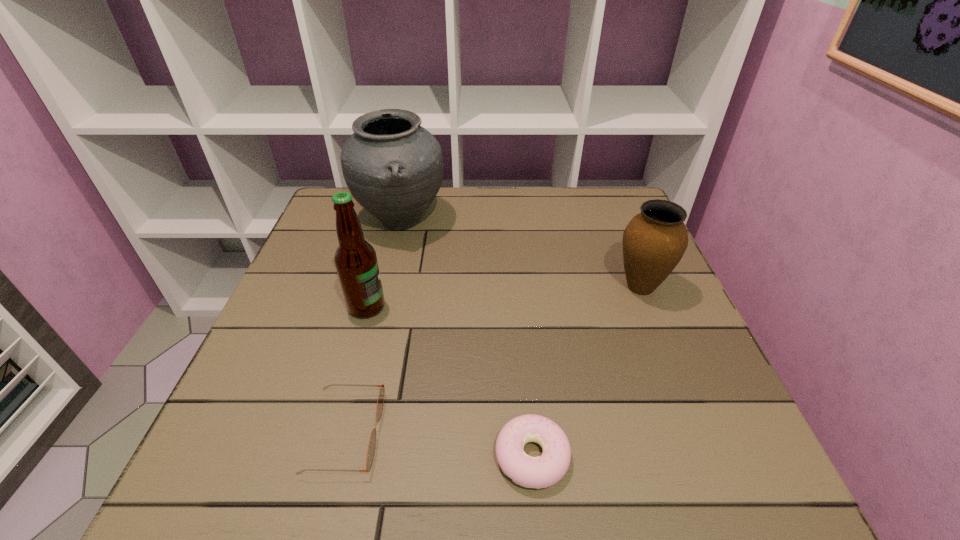
Where is `object that is at the near left corner`? object that is at the near left corner is located at coordinates (372, 442).

The width and height of the screenshot is (960, 540). What are the coordinates of `blank space at the far edge of the desktop` in the screenshot? It's located at (448, 196).

The height and width of the screenshot is (540, 960). In the image, there is a desktop. What are the coordinates of `vacant space at the near edge` in the screenshot? It's located at (x=420, y=501).

I want to click on vacant area at the left edge of the desktop, so click(x=277, y=368).

Locate an element on the screen. The image size is (960, 540). blank space at the right edge of the desktop is located at coordinates (685, 349).

The image size is (960, 540). Identify the location of vacant space at the near left corner. (203, 488).

In the image, there is a desktop. At what (x,y) coordinates should I click in order to perform the action: click on vacant area at the far right corner. Please return your answer as a coordinate pair (x, y). The height and width of the screenshot is (540, 960). Looking at the image, I should click on (610, 192).

I want to click on free space between the doughnut and the rightmost object, so click(x=587, y=372).

You are a GUI agent. You are given a task and a screenshot of the screen. Output one action in this format:
    pyautogui.click(x=<x>, y=<y>)
    Task: Click on the free spot between the farthest object and the rightmost object
    
    Given the screenshot: What is the action you would take?
    pyautogui.click(x=520, y=254)

Image resolution: width=960 pixels, height=540 pixels. I want to click on empty space that is in between the rightmost object and the sunglasses, so 492,360.